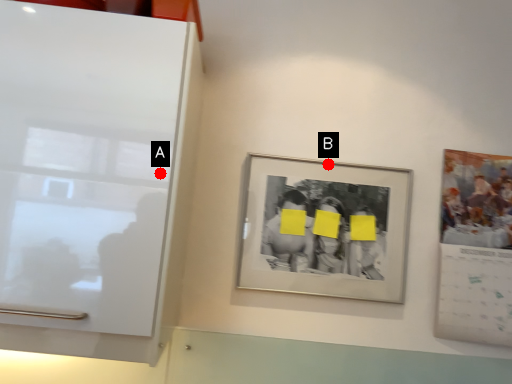
Question: Two points are circled on the image, labeled by A and B beside each circle. Among these points, which one is farthest from the camera?

Choices:
 (A) A is further
 (B) B is further

Answer: (B)